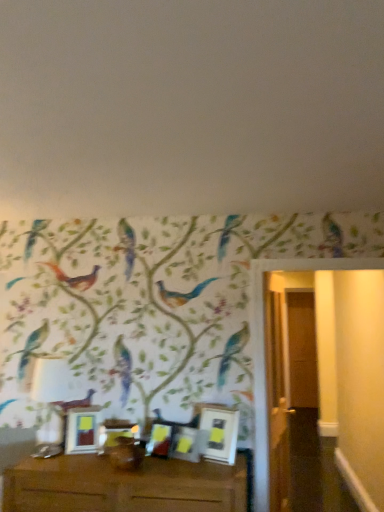
Question: Which direction should I rotate to look at matte gold picture frame at center, which is the 2th picture frame from left to right?

Choices:
 (A) right
 (B) left

Answer: (B)

Question: Which direction should I rotate to look at matte white picture frame at center, which appears as the 4th picture frame when viewed from the left, — up or down?

Choices:
 (A) up
 (B) down

Answer: (B)

Question: Is brown wooden table at lower center next to matte white picture frame at center, which ranks as the 5th picture frame in right-to-left order, and touching it?

Choices:
 (A) no
 (B) yes

Answer: (A)

Question: Is brown wooden table at lower center at the left side of matte white picture frame at center, which ranks as the 5th picture frame in right-to-left order?

Choices:
 (A) no
 (B) yes

Answer: (A)

Question: From a real-world perspective, is brown wooden table at lower center under matte white picture frame at center, which ranks as the 5th picture frame in right-to-left order?

Choices:
 (A) no
 (B) yes

Answer: (B)

Question: Is the position of brown wooden table at lower center less distant than that of matte white picture frame at center, which ranks as the 5th picture frame in right-to-left order?

Choices:
 (A) yes
 (B) no

Answer: (A)

Question: From a real-world perspective, is brown wooden table at lower center located higher than matte white picture frame at center, the first picture frame from the left?

Choices:
 (A) no
 (B) yes

Answer: (A)

Question: Can you confirm if brown wooden table at lower center is taller than matte white picture frame at center, which ranks as the 5th picture frame in right-to-left order?

Choices:
 (A) yes
 (B) no

Answer: (A)

Question: Does matte white picture frame at center, the second picture frame from the right, have a lesser height compared to matte gold picture frame at center, the 4th picture frame when ordered from right to left?

Choices:
 (A) no
 (B) yes

Answer: (A)

Question: Considering the relative sizes of matte white picture frame at center, the second picture frame from the right, and matte gold picture frame at center, which is the 2th picture frame from left to right, in the image provided, is matte white picture frame at center, the second picture frame from the right, taller than matte gold picture frame at center, which is the 2th picture frame from left to right,?

Choices:
 (A) no
 (B) yes

Answer: (B)

Question: Is matte white picture frame at center, which appears as the 4th picture frame when viewed from the left, behind matte gold picture frame at center, the 4th picture frame when ordered from right to left?

Choices:
 (A) no
 (B) yes

Answer: (A)

Question: From a real-world perspective, is matte white picture frame at center, the second picture frame from the right, located beneath matte gold picture frame at center, the 4th picture frame when ordered from right to left?

Choices:
 (A) no
 (B) yes

Answer: (B)

Question: Is matte gold picture frame at center, which is the 2th picture frame from left to right, surrounded by matte white picture frame at center, the second picture frame from the right?

Choices:
 (A) no
 (B) yes

Answer: (A)

Question: From the image's perspective, is matte white picture frame at center, which appears as the 4th picture frame when viewed from the left, on top of matte gold picture frame at center, which is the 2th picture frame from left to right?

Choices:
 (A) yes
 (B) no

Answer: (A)

Question: From the image's perspective, is matte white picture frame at center, which ranks as the 5th picture frame in right-to-left order, above matte white picture frame at center, the second picture frame from the right?

Choices:
 (A) no
 (B) yes

Answer: (B)